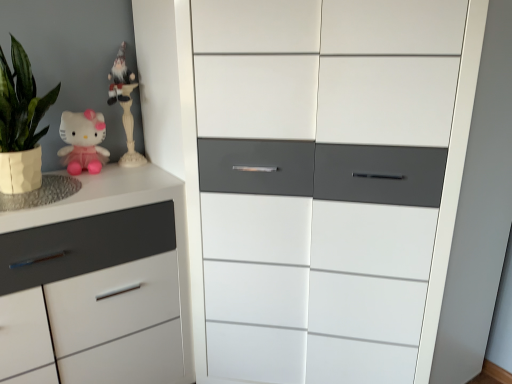
Question: Which direction should I rotate to look at white glossy cabinet at center, positioned as the second chest of drawers in left-to-right order, — up or down?

Choices:
 (A) up
 (B) down

Answer: (B)

Question: Does white matte chest of drawers at left, which ranks as the first chest of drawers in left-to-right order, contain white glossy gnome at upper left?

Choices:
 (A) yes
 (B) no

Answer: (B)

Question: Is white matte chest of drawers at left, the second chest of drawers positioned from the right, at the right side of white glossy gnome at upper left?

Choices:
 (A) yes
 (B) no

Answer: (B)

Question: Considering the relative sizes of white matte chest of drawers at left, which ranks as the first chest of drawers in left-to-right order, and white glossy gnome at upper left in the image provided, is white matte chest of drawers at left, which ranks as the first chest of drawers in left-to-right order, thinner than white glossy gnome at upper left?

Choices:
 (A) yes
 (B) no

Answer: (B)

Question: Can you see white matte chest of drawers at left, which ranks as the first chest of drawers in left-to-right order, touching white glossy gnome at upper left?

Choices:
 (A) no
 (B) yes

Answer: (A)

Question: Can you confirm if white matte chest of drawers at left, the second chest of drawers positioned from the right, is bigger than white glossy gnome at upper left?

Choices:
 (A) no
 (B) yes

Answer: (B)

Question: Does white matte chest of drawers at left, which ranks as the first chest of drawers in left-to-right order, have a greater height compared to white glossy gnome at upper left?

Choices:
 (A) no
 (B) yes

Answer: (B)

Question: Is white matte chest of drawers at left, which ranks as the first chest of drawers in left-to-right order, in contact with matte pink plush at upper left?

Choices:
 (A) no
 (B) yes

Answer: (A)

Question: Is white matte chest of drawers at left, which ranks as the first chest of drawers in left-to-right order, bigger than matte pink plush at upper left?

Choices:
 (A) yes
 (B) no

Answer: (A)

Question: Considering the relative sizes of white matte chest of drawers at left, the second chest of drawers positioned from the right, and matte pink plush at upper left in the image provided, is white matte chest of drawers at left, the second chest of drawers positioned from the right, shorter than matte pink plush at upper left?

Choices:
 (A) yes
 (B) no

Answer: (B)

Question: From a real-world perspective, is white matte chest of drawers at left, the second chest of drawers positioned from the right, physically above matte pink plush at upper left?

Choices:
 (A) yes
 (B) no

Answer: (B)

Question: From the image's perspective, does white matte chest of drawers at left, which ranks as the first chest of drawers in left-to-right order, appear lower than matte pink plush at upper left?

Choices:
 (A) yes
 (B) no

Answer: (A)

Question: Is white matte chest of drawers at left, which ranks as the first chest of drawers in left-to-right order, facing towards matte pink plush at upper left?

Choices:
 (A) yes
 (B) no

Answer: (B)

Question: Is white glossy cabinet at center, the 1th chest of drawers viewed from the right, further to the viewer compared to matte pink plush at upper left?

Choices:
 (A) yes
 (B) no

Answer: (B)